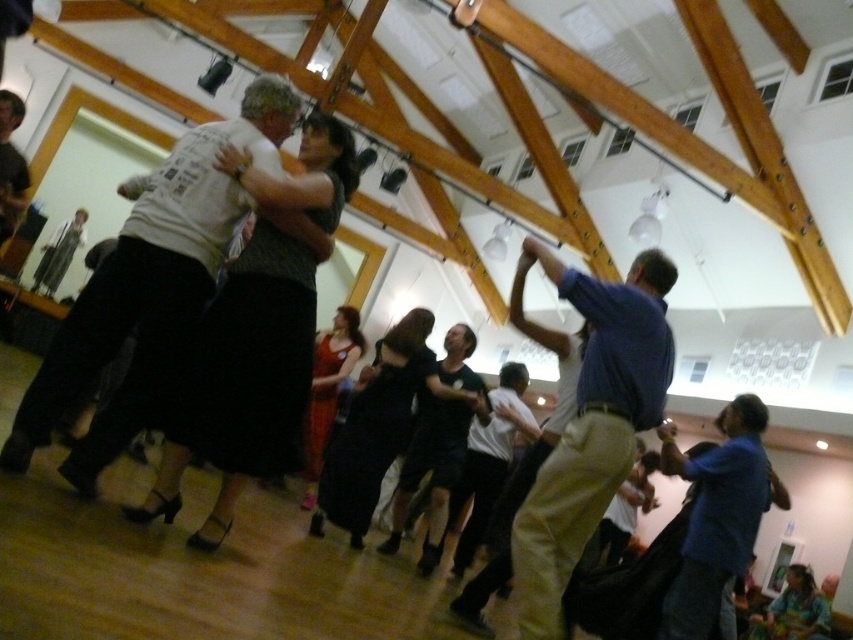
Based on the photo, does dark gray cotton shirt at upper left have a lesser width compared to khaki pants at center?

In fact, dark gray cotton shirt at upper left might be wider than khaki pants at center.

At what (x,y) coordinates should I click in order to perform the action: click on dark gray cotton shirt at upper left. Please return your answer as a coordinate pair (x, y). Image resolution: width=853 pixels, height=640 pixels. Looking at the image, I should click on (146, 292).

You are a GUI agent. You are given a task and a screenshot of the screen. Output one action in this format:
    pyautogui.click(x=<x>, y=<y>)
    Task: Click on the dark gray cotton shirt at upper left
    The width and height of the screenshot is (853, 640).
    Given the screenshot: What is the action you would take?
    pyautogui.click(x=146, y=292)

This screenshot has height=640, width=853. What are the coordinates of `dark gray cotton shirt at upper left` in the screenshot? It's located at (146, 292).

Is khaki pants at center to the right of blue fabric shirt at lower right from the viewer's perspective?

Incorrect, khaki pants at center is not on the right side of blue fabric shirt at lower right.

Who is positioned more to the right, khaki pants at center or blue fabric shirt at lower right?

Positioned to the right is blue fabric shirt at lower right.

Identify the location of khaki pants at center. This screenshot has width=853, height=640. (590, 428).

Who is positioned more to the left, dark gray cotton shirt at upper left or blue fabric shirt at lower right?

Positioned to the left is dark gray cotton shirt at upper left.

Consider the image. Does dark gray cotton shirt at upper left appear on the left side of blue fabric shirt at lower right?

Correct, you'll find dark gray cotton shirt at upper left to the left of blue fabric shirt at lower right.

Between point (62, 470) and point (743, 467), which one is positioned behind?

The point (743, 467) is more distant.

In order to click on dark gray cotton shirt at upper left in this screenshot , I will do `click(146, 292)`.